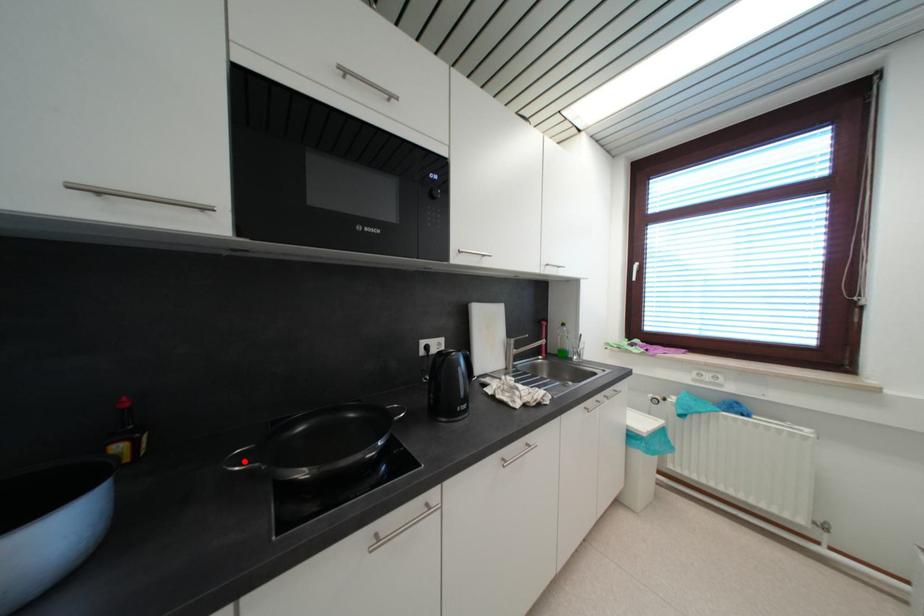
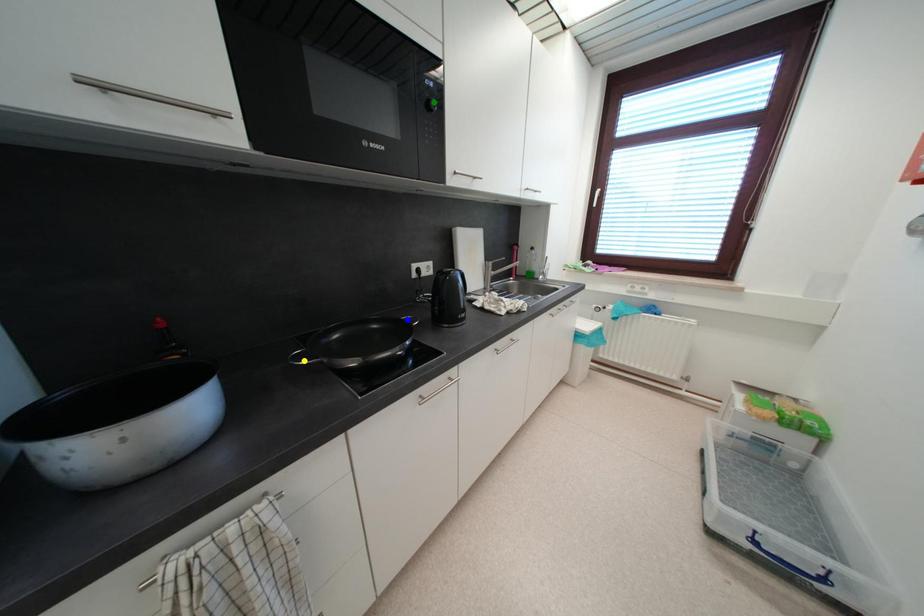
Question: I am providing you with two images of the same scene from different viewpoints. A red point is marked on the first image. You are given multiple points on the second image. Which mark in image 2 goes with the point in image 1?

Choices:
 (A) green point
 (B) blue point
 (C) yellow point

Answer: (C)